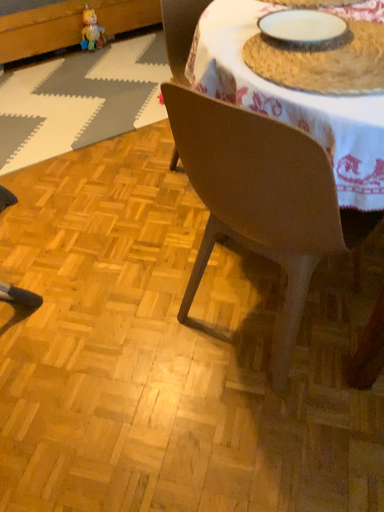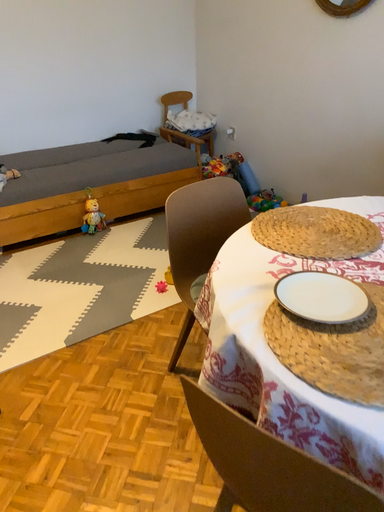
Question: How did the camera likely rotate when shooting the video?

Choices:
 (A) rotated downward
 (B) rotated upward

Answer: (B)